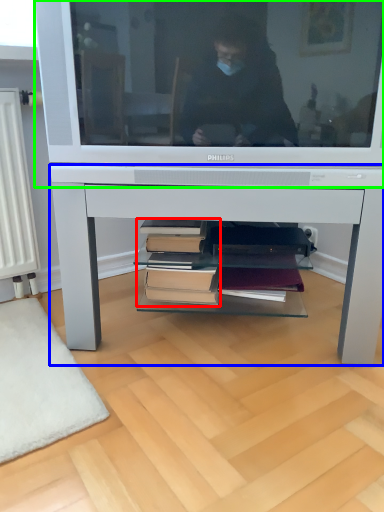
Question: Estimate the real-world distances between objects in this image. Which object is farther from book (highlighted by a red box), desk (highlighted by a blue box) or television (highlighted by a green box)?

Choices:
 (A) desk
 (B) television

Answer: (B)